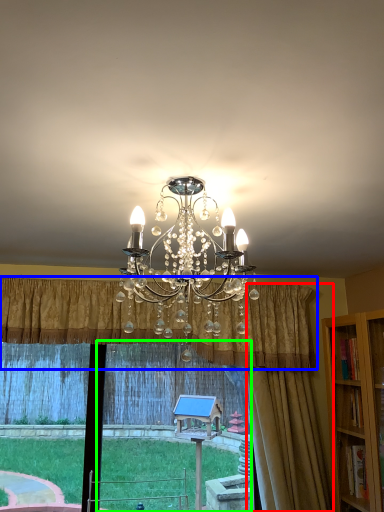
Question: Considering the real-world distances, which object is closest to curtain (highlighted by a red box)? curtain (highlighted by a blue box) or window frame (highlighted by a green box).

Choices:
 (A) curtain
 (B) window frame

Answer: (A)